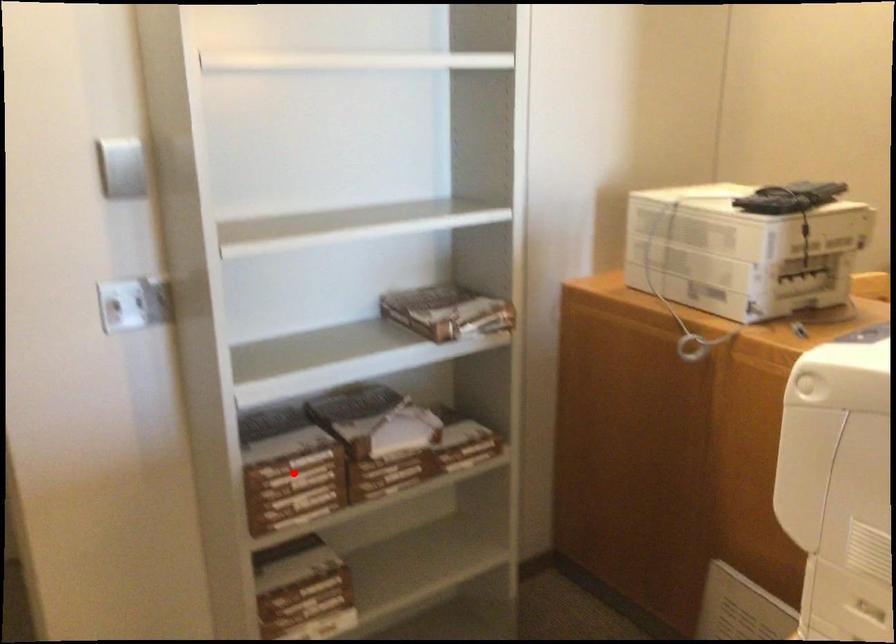
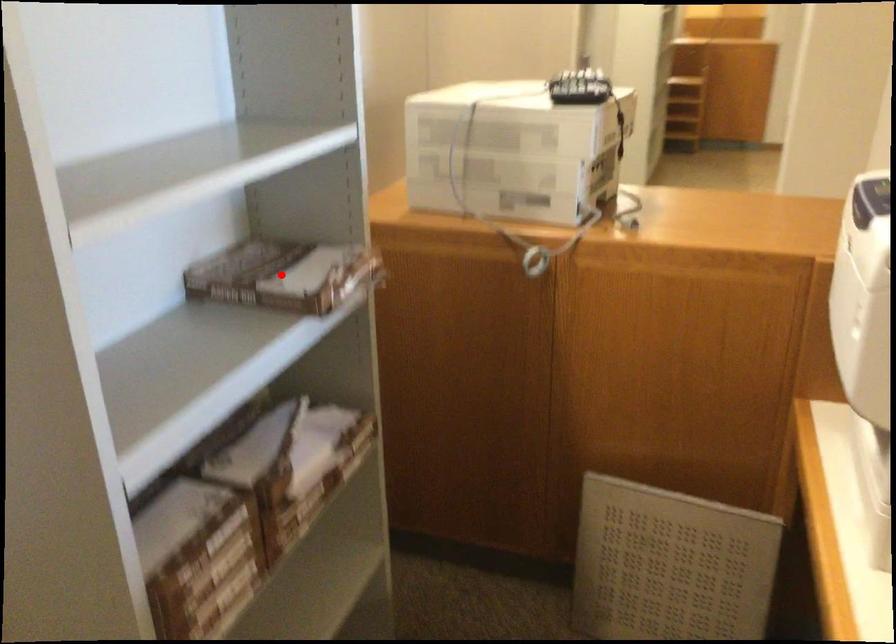
I am providing you with two images of the same scene from different viewpoints. A red point is marked on the first image and another point is marked on the second image. Are the points marked in image1 and image2 representing the same 3D position?

No